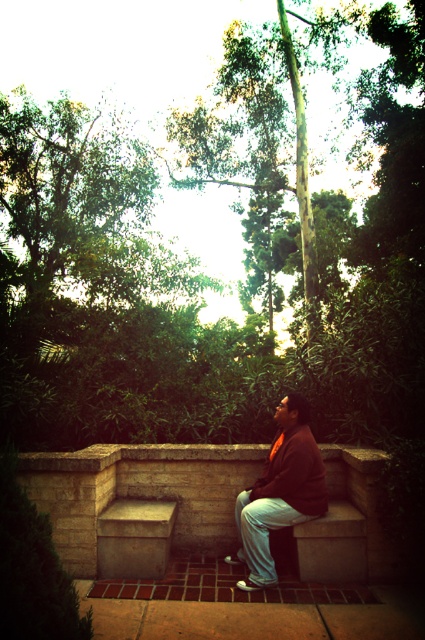
What do you see at coordinates (139, 492) in the screenshot? The width and height of the screenshot is (425, 640). I see `stone bench at center` at bounding box center [139, 492].

Between stone bench at center and matte brown jacket at center, which one appears on the left side from the viewer's perspective?

Positioned to the left is stone bench at center.

Measure the distance between point (190, 460) and camera.

The distance of point (190, 460) from camera is 17.07 feet.

Identify the location of stone bench at center. (139, 492).